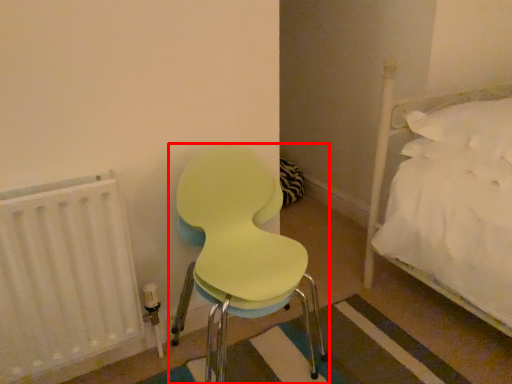
Question: From the image's perspective, considering the relative positions of chair (annotated by the red box) and radiator in the image provided, where is chair (annotated by the red box) located with respect to the staircase?

Choices:
 (A) below
 (B) above

Answer: (B)